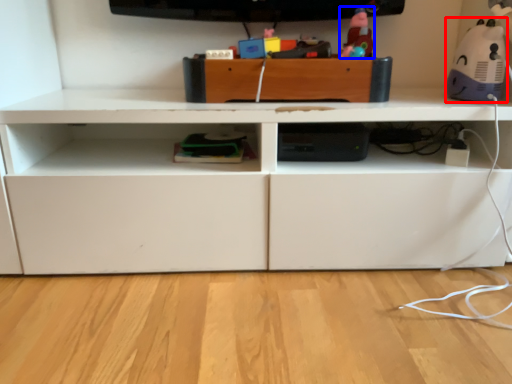
Question: Which of the following is the closest to the observer, toy (highlighted by a red box) or toy (highlighted by a blue box)?

Choices:
 (A) toy
 (B) toy

Answer: (A)